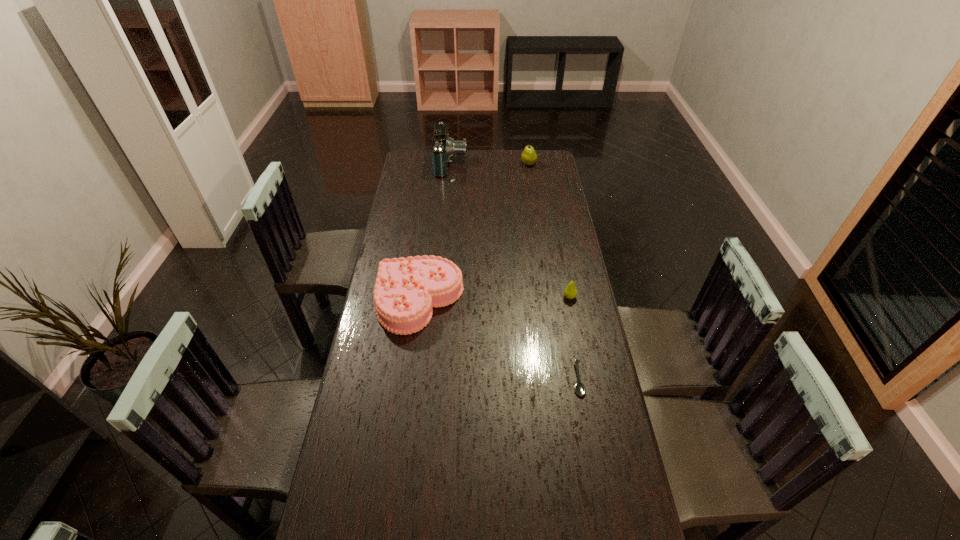
Locate an element on the screen. The image size is (960, 540). the tallest object is located at coordinates (443, 148).

Where is `the farther pear`? The height and width of the screenshot is (540, 960). the farther pear is located at coordinates (529, 157).

The height and width of the screenshot is (540, 960). I want to click on the taller pear, so click(529, 157).

Identify the location of the shorter pear. tap(570, 292).

The height and width of the screenshot is (540, 960). Find the location of `the nearer pear`. the nearer pear is located at coordinates (570, 292).

What are the coordinates of `cake` in the screenshot? It's located at (406, 289).

This screenshot has width=960, height=540. Find the location of `the shortest object`. the shortest object is located at coordinates (580, 389).

The height and width of the screenshot is (540, 960). I want to click on soupspoon, so click(580, 389).

The image size is (960, 540). In order to click on free point located 0.080m on the front-facing side of the tallest object in this screenshot , I will do `click(483, 164)`.

What are the coordinates of `free space located 0.070m on the front of the taller pear` in the screenshot? It's located at (530, 176).